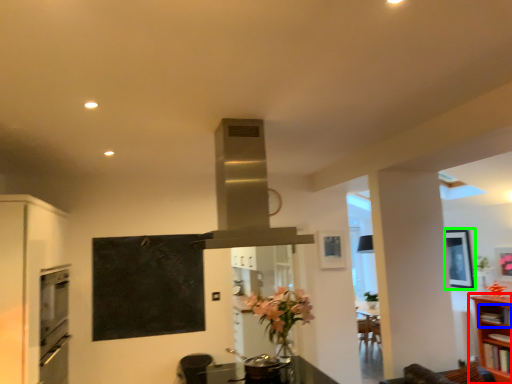
Question: Considering the real-world distances, which object is farthest from shelf (highlighted by a red box)? shelf (highlighted by a blue box) or picture frame (highlighted by a green box)?

Choices:
 (A) shelf
 (B) picture frame

Answer: (B)